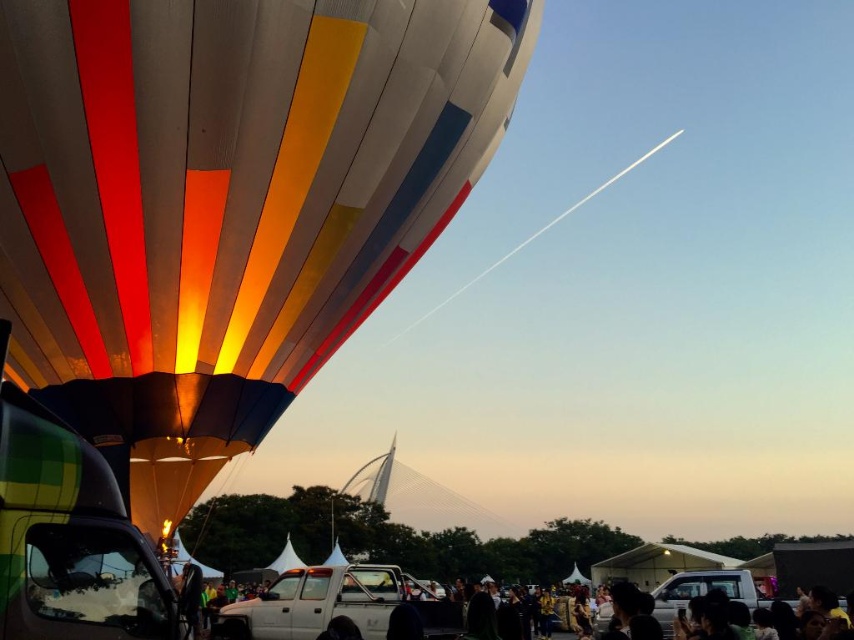
Question: Which object is farther from the camera taking this photo?

Choices:
 (A) multicolored fabric hot air balloon at upper left
 (B) matte black crowd at lower center

Answer: (B)

Question: Which point appears closest to the camera in this image?

Choices:
 (A) (373, 74)
 (B) (279, 596)

Answer: (A)

Question: Does multicolored fabric hot air balloon at upper left lie in front of matte black crowd at lower center?

Choices:
 (A) no
 (B) yes

Answer: (B)

Question: Which point is closer to the camera?

Choices:
 (A) multicolored fabric hot air balloon at upper left
 (B) matte black crowd at lower center

Answer: (A)

Question: Is multicolored fabric hot air balloon at upper left wider than matte black crowd at lower center?

Choices:
 (A) yes
 (B) no

Answer: (B)

Question: Is multicolored fabric hot air balloon at upper left below matte black crowd at lower center?

Choices:
 (A) no
 (B) yes

Answer: (A)